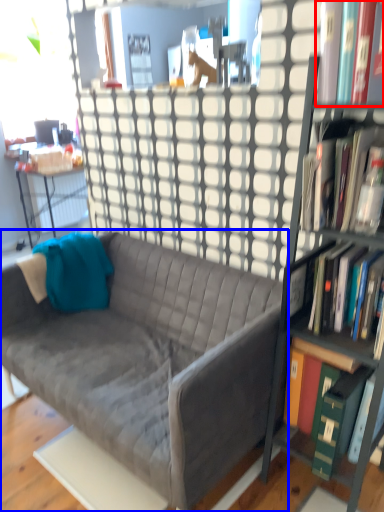
Question: Which object appears farthest to the camera in this image, book (highlighted by a red box) or studio couch (highlighted by a blue box)?

Choices:
 (A) book
 (B) studio couch

Answer: (B)